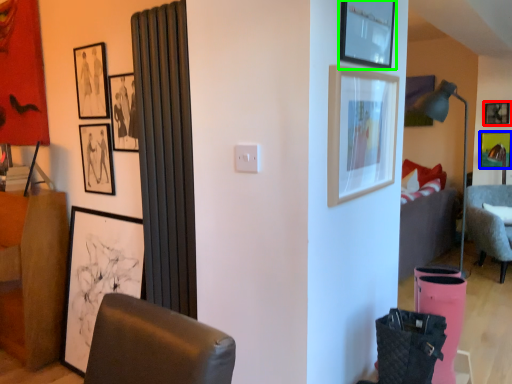
Question: Which is farther away from picture frame (highlighted by a red box)? picture frame (highlighted by a blue box) or picture frame (highlighted by a green box)?

Choices:
 (A) picture frame
 (B) picture frame

Answer: (B)